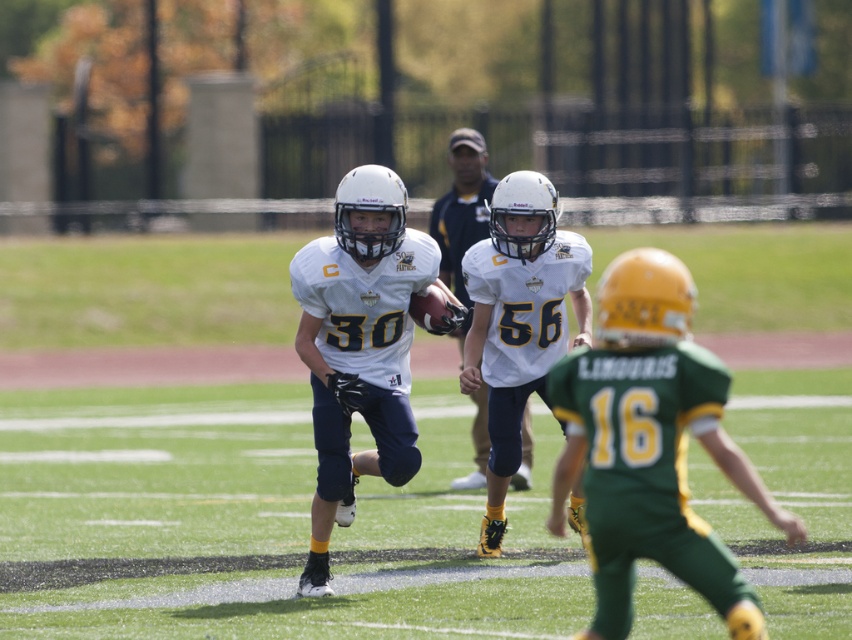
Question: Which point is closer to the camera taking this photo?

Choices:
 (A) [471, 144]
 (B) [459, 372]
 (C) [653, 253]
 (D) [419, 260]

Answer: (C)

Question: Among these objects, which one is farthest from the camera?

Choices:
 (A) green/yellow jersey at center
 (B) green artificial turf at center

Answer: (B)

Question: Where is green artificial turf at center located in relation to white matte jersey at center in the image?

Choices:
 (A) left
 (B) right

Answer: (A)

Question: Does green/yellow jersey at center have a smaller size compared to white matte helmet at center?

Choices:
 (A) yes
 (B) no

Answer: (A)

Question: Which object is the farthest from the white matte jersey at center?

Choices:
 (A) white matte helmet at center
 (B) white matte football helmet at center
 (C) green artificial turf at center

Answer: (C)

Question: Is green artificial turf at center to the left of white matte football helmet at center from the viewer's perspective?

Choices:
 (A) yes
 (B) no

Answer: (A)